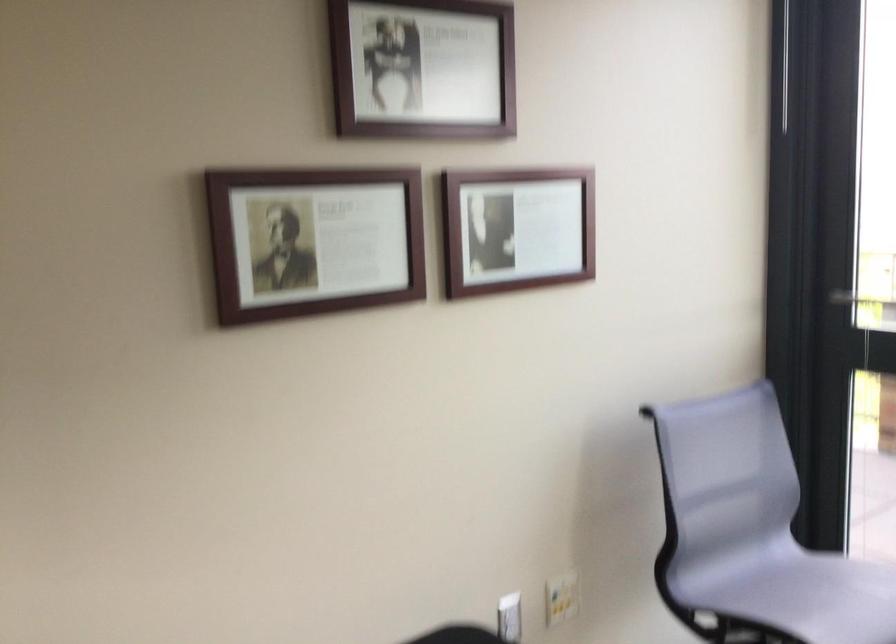
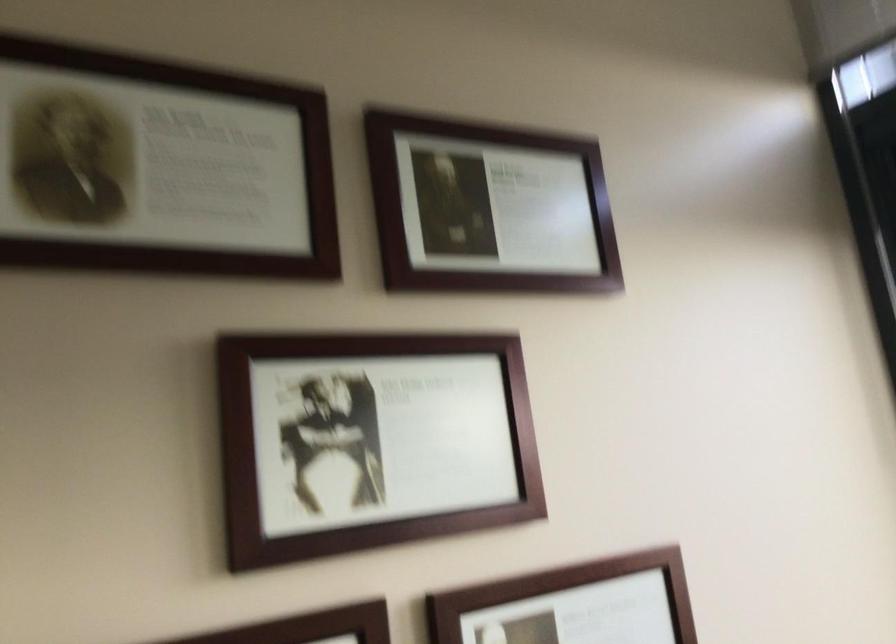
Question: How did the camera likely rotate?

Choices:
 (A) Left
 (B) Right
 (C) Up
 (D) Down

Answer: (C)